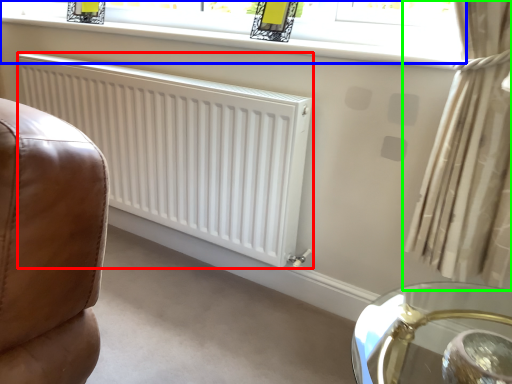
Question: Based on their relative distances, which object is nearer to radiator (highlighted by a red box)? Choose from window (highlighted by a blue box) and curtain (highlighted by a green box).

Choices:
 (A) window
 (B) curtain

Answer: (A)